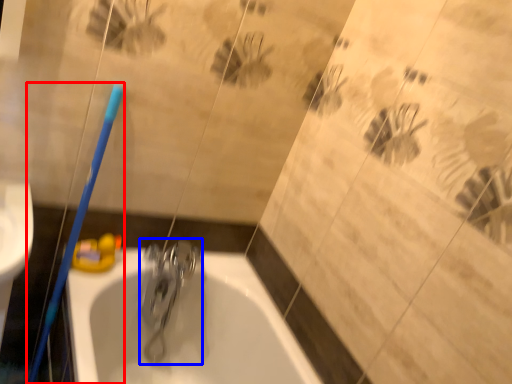
Question: Which of the following is the farthest to the observer, toothbrush (highlighted by a red box) or tap (highlighted by a blue box)?

Choices:
 (A) toothbrush
 (B) tap

Answer: (B)